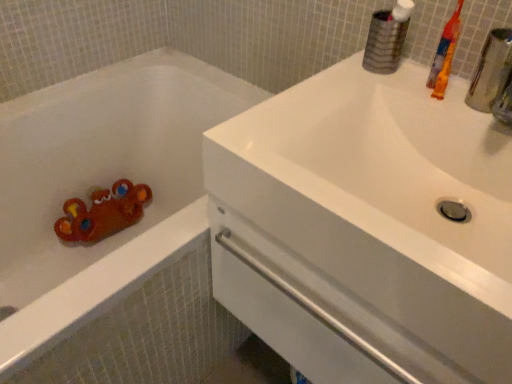
Question: In terms of width, does matte plastic bathtub at left look wider or thinner when compared to orange plastic toothbrush at upper right?

Choices:
 (A) wide
 (B) thin

Answer: (A)

Question: From the image's perspective, relative to orange plastic toothbrush at upper right, is matte plastic bathtub at left above or below?

Choices:
 (A) below
 (B) above

Answer: (A)

Question: Which object is the closest to the matte plastic bathtub at left?

Choices:
 (A) white glossy sink at upper right
 (B) orange plastic toothbrush at upper right

Answer: (A)

Question: Which object is the closest to the white glossy sink at upper right?

Choices:
 (A) orange plastic toothbrush at upper right
 (B) matte plastic bathtub at left

Answer: (A)